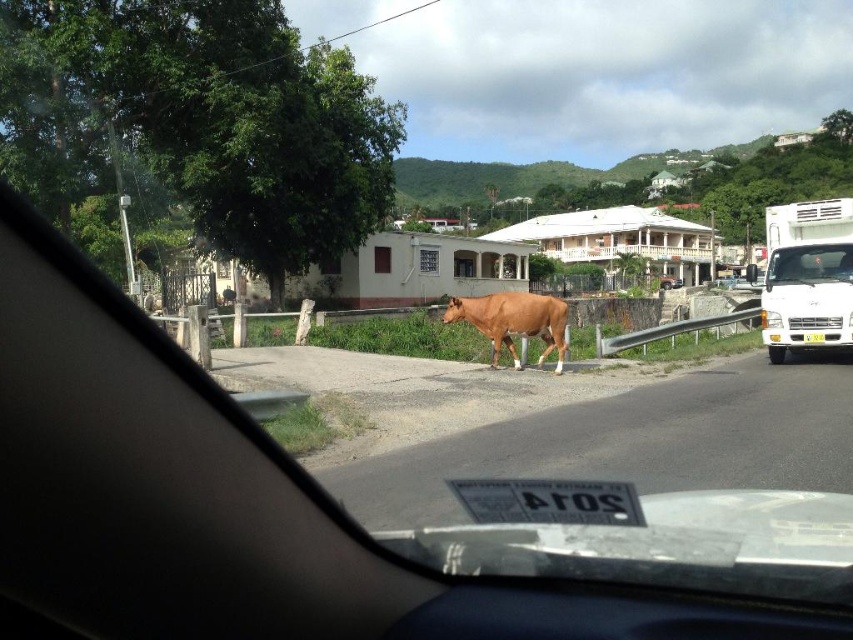
Question: Estimate the real-world distances between objects in this image. Which object is closer to the matte white truck at center?

Choices:
 (A) white matte truck at right
 (B) brown glossy bull at center

Answer: (B)

Question: Can you confirm if white matte truck at right is positioned above brown glossy bull at center?

Choices:
 (A) no
 (B) yes

Answer: (B)

Question: Does matte white truck at center appear on the left side of brown glossy bull at center?

Choices:
 (A) yes
 (B) no

Answer: (A)

Question: Is white matte truck at right wider than brown glossy bull at center?

Choices:
 (A) yes
 (B) no

Answer: (B)

Question: Which object is closer to the camera taking this photo?

Choices:
 (A) white matte truck at right
 (B) matte white truck at center
 (C) brown glossy bull at center

Answer: (B)

Question: Which object appears farthest from the camera in this image?

Choices:
 (A) matte white truck at center
 (B) white matte truck at right
 (C) brown glossy bull at center

Answer: (B)